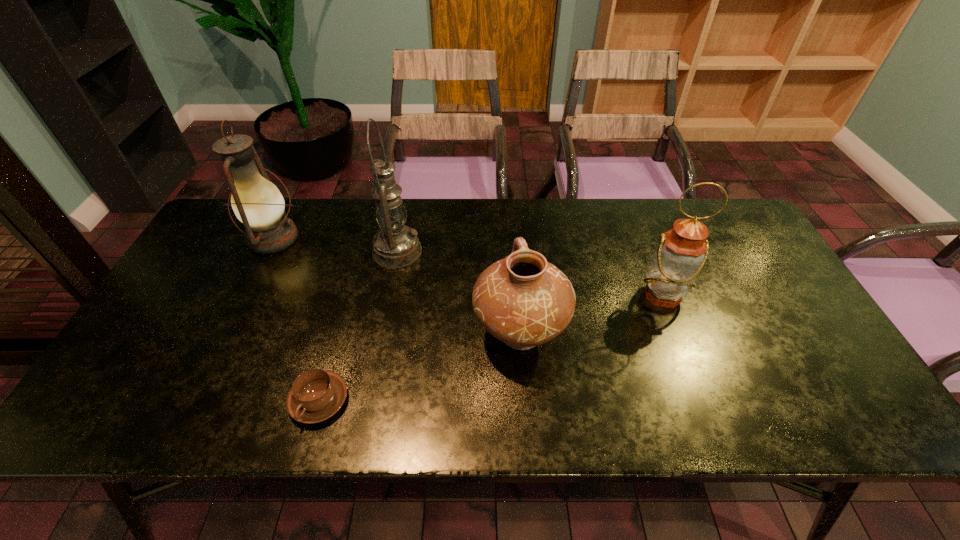
The image size is (960, 540). What are the coordinates of `the fourth closest object to the second shortest object` in the screenshot? It's located at (257, 203).

Identify which object is the fourth closest to the leftmost oil lamp. Please provide its 2D coordinates. Your answer should be formatted as a tuple, i.e. [(x, y)], where the tuple contains the x and y coordinates of a point satisfying the conditions above.

[(682, 252)]

Locate which oil lamp is the second closest to the rightmost oil lamp. Please provide its 2D coordinates. Your answer should be formatted as a tuple, i.e. [(x, y)], where the tuple contains the x and y coordinates of a point satisfying the conditions above.

[(257, 203)]

Where is `oil lamp identified as the second closest to the rightmost object`? Image resolution: width=960 pixels, height=540 pixels. oil lamp identified as the second closest to the rightmost object is located at coordinates (257, 203).

Image resolution: width=960 pixels, height=540 pixels. Identify the location of vacant space that satisfies the following two spatial constraints: 1. on the side of the second object from right to left with the handle; 2. on the right side of the nearest oil lamp. click(516, 296).